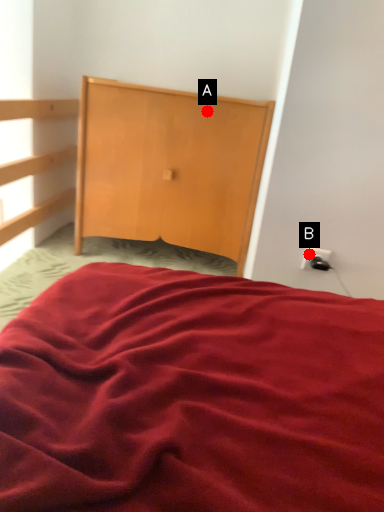
Question: Two points are circled on the image, labeled by A and B beside each circle. Which of the following is the closest to the observer?

Choices:
 (A) A is closer
 (B) B is closer

Answer: (B)